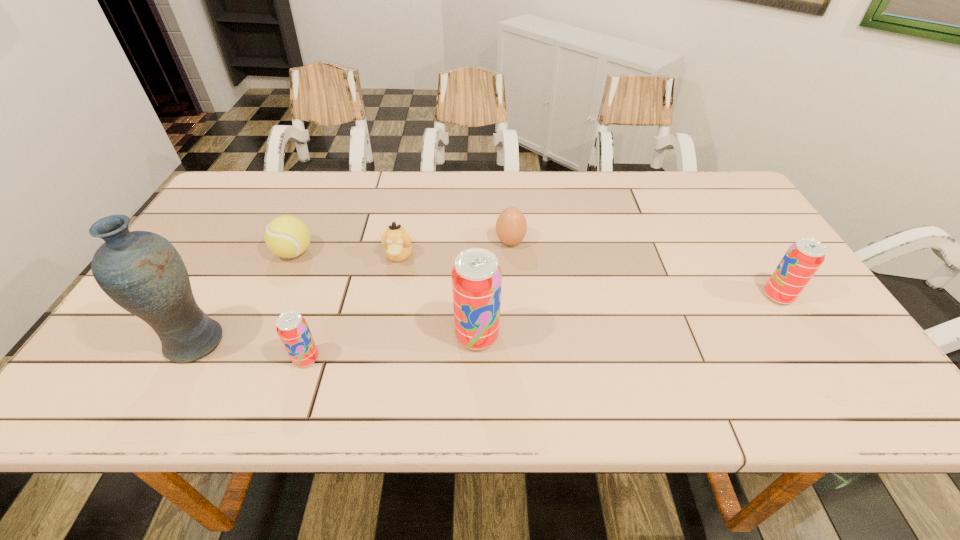
Identify the location of the leftmost soda can. The height and width of the screenshot is (540, 960). (292, 328).

What are the coordinates of `the shortest soda can` in the screenshot? It's located at (292, 328).

I want to click on the sixth shortest object, so click(x=476, y=277).

This screenshot has height=540, width=960. In order to click on the tallest soda can in this screenshot , I will do `click(476, 277)`.

Where is `the third tallest object`? The height and width of the screenshot is (540, 960). the third tallest object is located at coordinates (803, 258).

The width and height of the screenshot is (960, 540). In order to click on the rightmost object in this screenshot , I will do `click(803, 258)`.

This screenshot has width=960, height=540. Identify the location of the sixth object from right to left. (286, 236).

Identify the location of duckling. This screenshot has width=960, height=540. (398, 247).

I want to click on boiled egg, so click(x=511, y=226).

Where is `the leftmost object`? The height and width of the screenshot is (540, 960). the leftmost object is located at coordinates (141, 271).